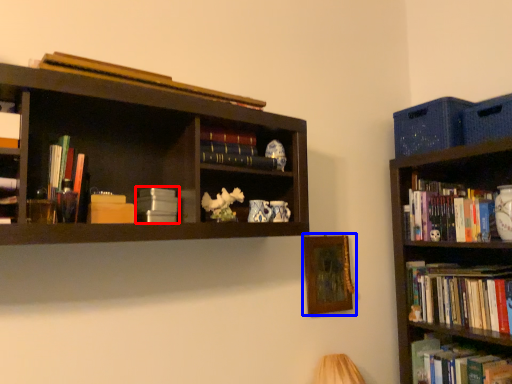
Question: Among these objects, which one is farthest to the camera, book (highlighted by a red box) or picture frame (highlighted by a blue box)?

Choices:
 (A) book
 (B) picture frame

Answer: (B)